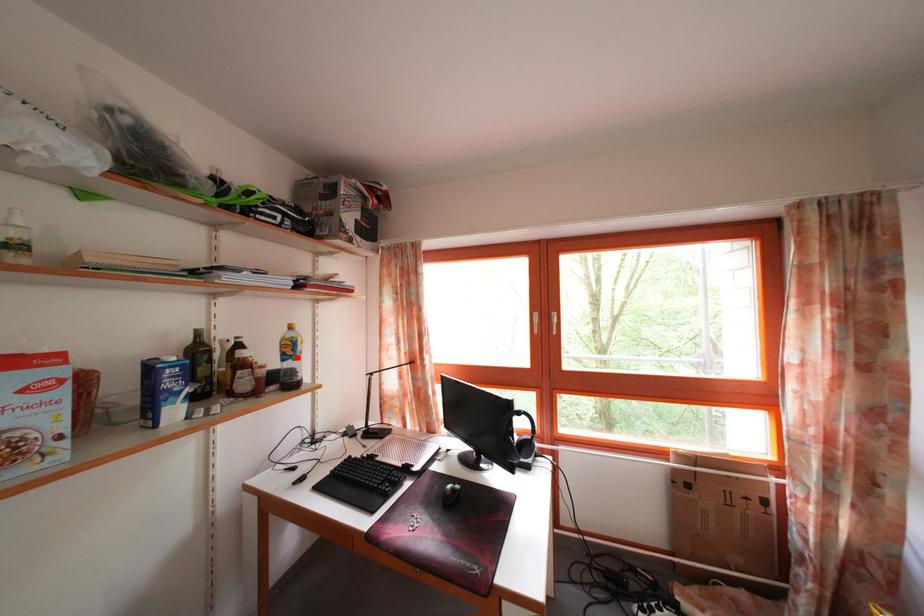
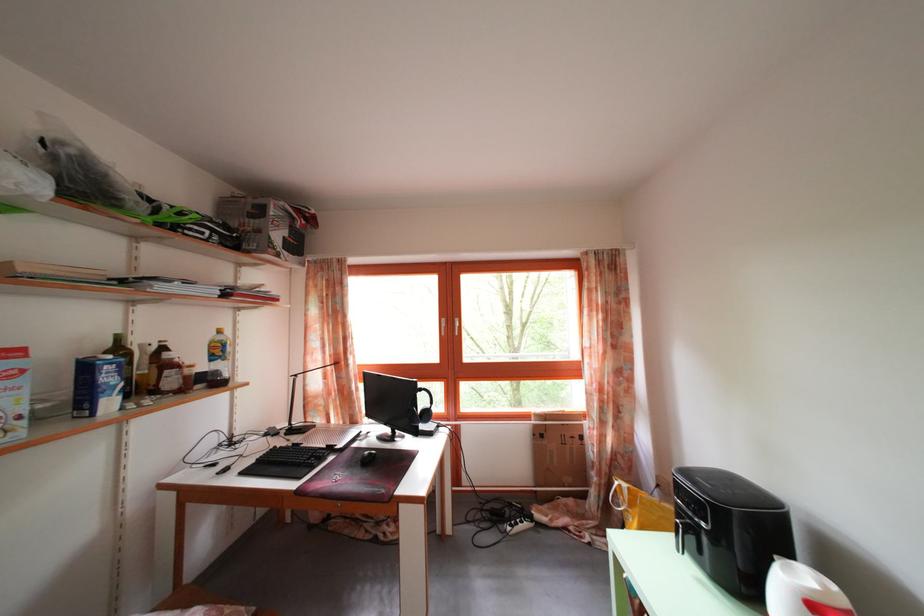
In the second image, find the point that corresponds to the highlighted location in the first image.

(225, 359)